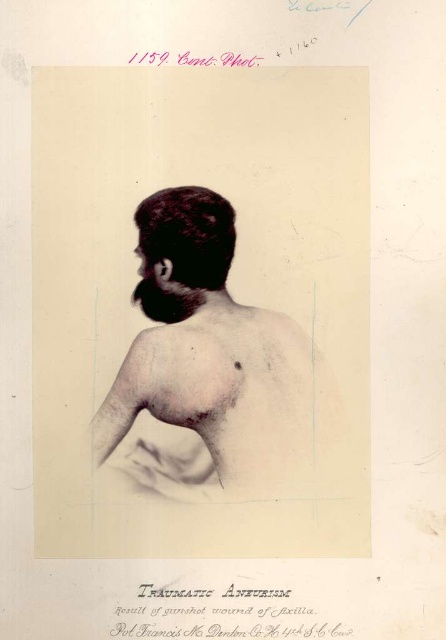
Based on the image description, which object has a greater width between the smooth skin back at center and the dark matte hair at center?

The smooth skin back at center has a greater width than the dark matte hair at center according to the description.

Based on the scene, which object is bigger between the smooth skin back at center and the dark matte hair at center?

The smooth skin back at center is larger in size compared to the dark matte hair at center.

You are a medical student observing this historical photograph. You notice two features on the subject, the smooth skin back at center and the dark matte hair at center. Based on their positions, which one is located to the right side of the other?

The smooth skin back at center is to the right of dark matte hair at center.